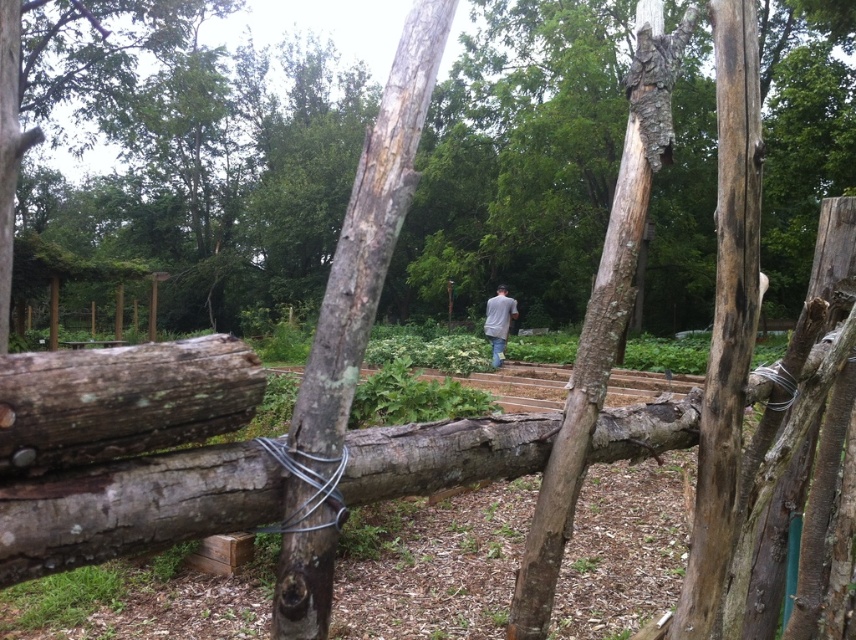
Question: Which of the following is the farthest from the observer?

Choices:
 (A) dark brown wood pole at center
 (B) gray matte shirt at center
 (C) rough bark tree at center
 (D) smooth brown tree trunk at center

Answer: (B)

Question: Considering the relative positions of dark brown wood pole at center and smooth brown tree trunk at center in the image provided, where is dark brown wood pole at center located with respect to smooth brown tree trunk at center?

Choices:
 (A) above
 (B) below

Answer: (B)

Question: Which point appears closest to the camera in this image?

Choices:
 (A) (324, 448)
 (B) (704, 403)

Answer: (A)

Question: Does dark brown wood pole at center appear on the right side of smooth brown tree trunk at center?

Choices:
 (A) no
 (B) yes

Answer: (B)

Question: Estimate the real-world distances between objects in this image. Which object is closer to the grayish-brown bark at center?

Choices:
 (A) smooth brown tree trunk at center
 (B) gray matte shirt at center
 (C) dark brown wood pole at center

Answer: (A)

Question: Does grayish-brown bark at center appear over smooth brown tree trunk at center?

Choices:
 (A) yes
 (B) no

Answer: (A)